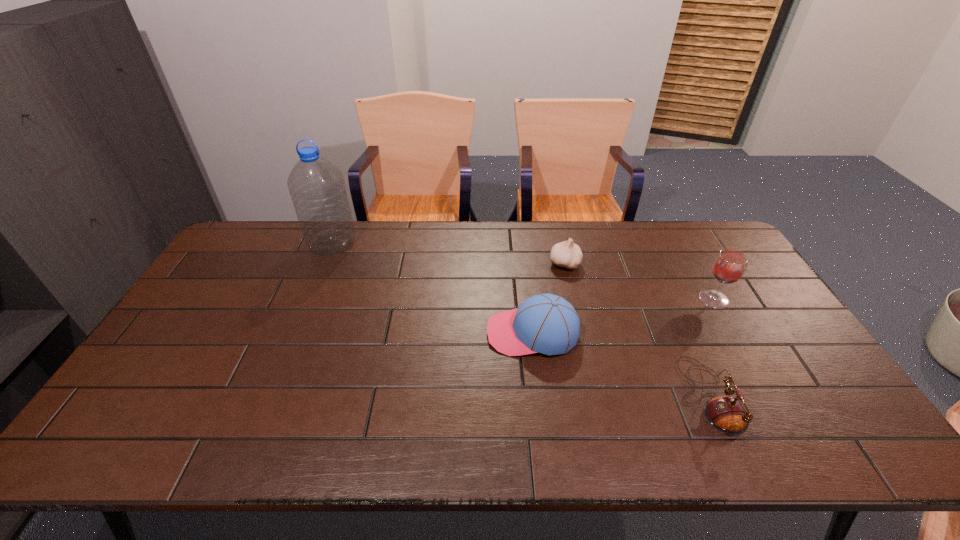
Locate an element on the screen. This screenshot has width=960, height=540. free space at the far edge of the desktop is located at coordinates click(665, 222).

The height and width of the screenshot is (540, 960). Identify the location of vacant space at the near edge of the desktop. (185, 449).

At what (x,y) coordinates should I click in order to perform the action: click on vacant space at the left edge of the desktop. Please return your answer as a coordinate pair (x, y). This screenshot has width=960, height=540. Looking at the image, I should click on (233, 295).

I want to click on vacant space at the right edge of the desktop, so click(x=777, y=324).

Where is `vacant space at the far left corner of the desktop`? vacant space at the far left corner of the desktop is located at coordinates (281, 229).

Image resolution: width=960 pixels, height=540 pixels. What are the coordinates of `vacant space that's between the tallest object and the garlic` in the screenshot? It's located at (448, 253).

Find the location of a particular element. Image resolution: width=960 pixels, height=540 pixels. empty space that is in between the fourth shortest object and the garlic is located at coordinates (639, 281).

Where is `unoccupied position between the water jug and the rightmost object`? The width and height of the screenshot is (960, 540). unoccupied position between the water jug and the rightmost object is located at coordinates (523, 271).

Locate an element on the screen. free spot between the garlic and the leftmost object is located at coordinates (448, 253).

Locate an element on the screen. vacant area that lies between the rightmost object and the garlic is located at coordinates (639, 281).